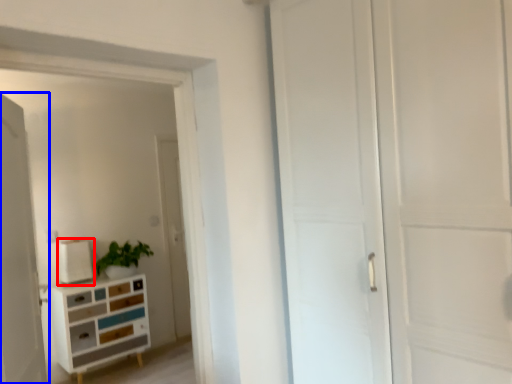
Question: Which point is further to the camera, appliance (highlighted by a red box) or door (highlighted by a blue box)?

Choices:
 (A) appliance
 (B) door

Answer: (A)